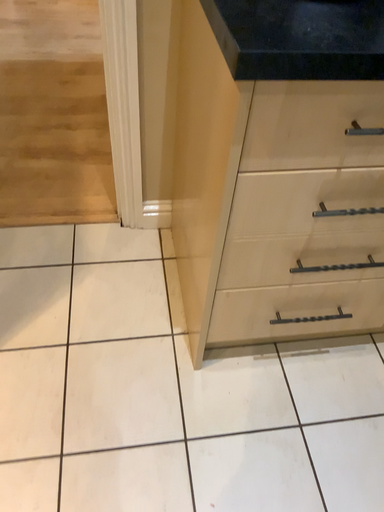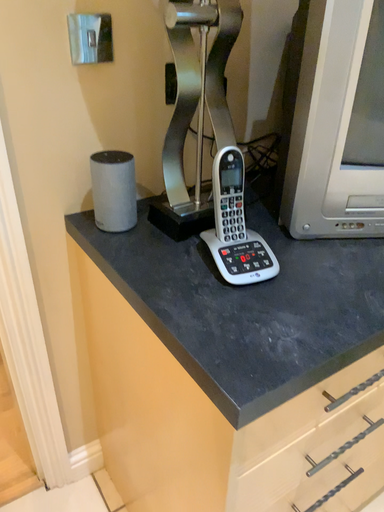
Question: Which way did the camera rotate in the video?

Choices:
 (A) rotated upward
 (B) rotated downward

Answer: (A)